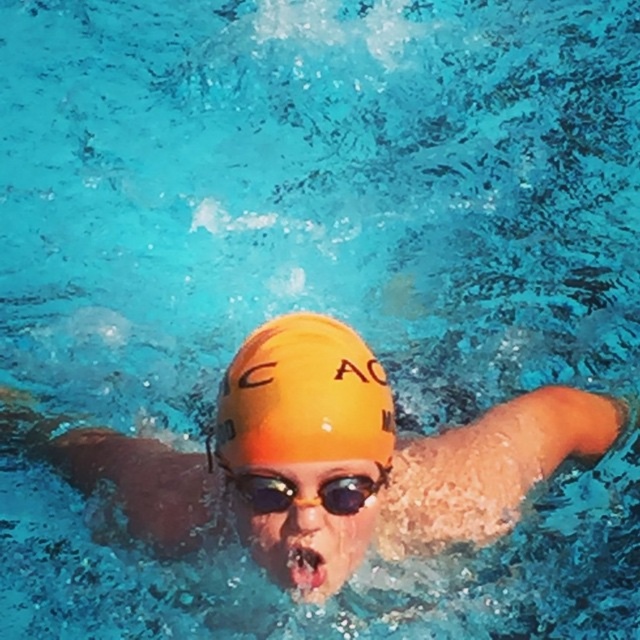
Question: Considering the relative positions of orange matte swim cap at center and transparent yellow goggles at center in the image provided, where is orange matte swim cap at center located with respect to transparent yellow goggles at center?

Choices:
 (A) above
 (B) below

Answer: (B)

Question: Considering the real-world distances, which object is closest to the transparent yellow goggles at center?

Choices:
 (A) orange matte swim cap at center
 (B) yellow matte swim cap at center

Answer: (B)

Question: Can you confirm if yellow matte swim cap at center is positioned above transparent yellow goggles at center?

Choices:
 (A) yes
 (B) no

Answer: (A)

Question: Is yellow matte swim cap at center wider than transparent yellow goggles at center?

Choices:
 (A) no
 (B) yes

Answer: (B)

Question: Estimate the real-world distances between objects in this image. Which object is closer to the yellow matte swim cap at center?

Choices:
 (A) transparent yellow goggles at center
 (B) orange matte swim cap at center

Answer: (A)

Question: Estimate the real-world distances between objects in this image. Which object is closer to the transparent yellow goggles at center?

Choices:
 (A) orange matte swim cap at center
 (B) yellow matte swim cap at center

Answer: (B)